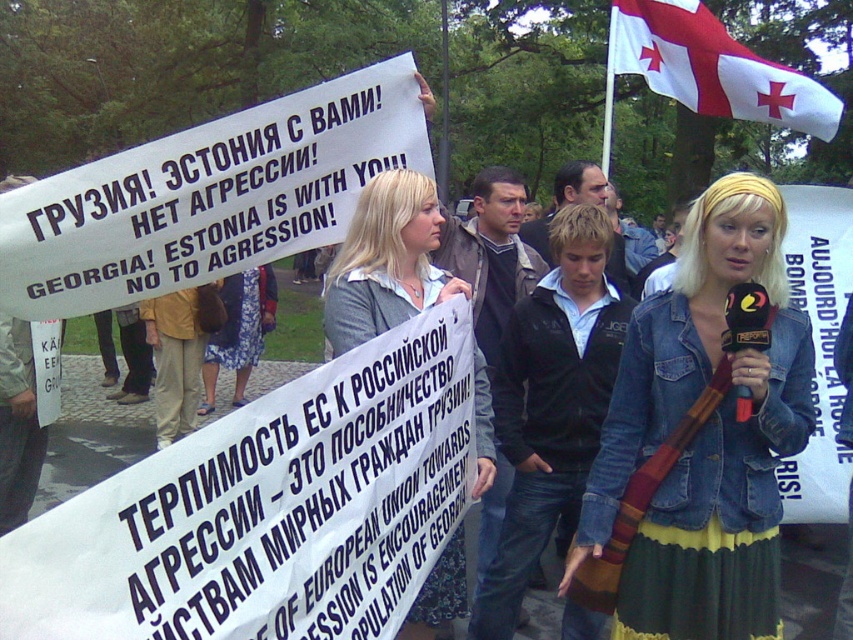
You are a photographer trying to capture a photo of the protest scene. You notice a denim jacket at lower right and a dark blue jeans at center. Which clothing item is positioned closer to the camera?

The denim jacket at lower right is positioned closer to the camera than the dark blue jeans at center because it might be wider than the dark blue jeans at center.

You are a photographer at the protest scene. You want to take a photo that includes both the dark blue jacket at center and the white fabric flag at upper right. Considering their sizes, which object should you focus on to ensure both are visible in the frame?

The dark blue jacket at center has a greater height compared to the white fabric flag at upper right. To ensure both are visible, focus on the dark blue jacket at center as it is taller and can help frame the composition with the smaller flag.

You are a photographer at the protest scene. You want to take a photo that includes both the denim jacket at lower right and the dark blue jeans at center. Which object should you focus on first to ensure both are in frame?

The denim jacket at lower right is positioned under the dark blue jeans at center, so you should focus on the dark blue jeans at center first to ensure both are captured in the frame.